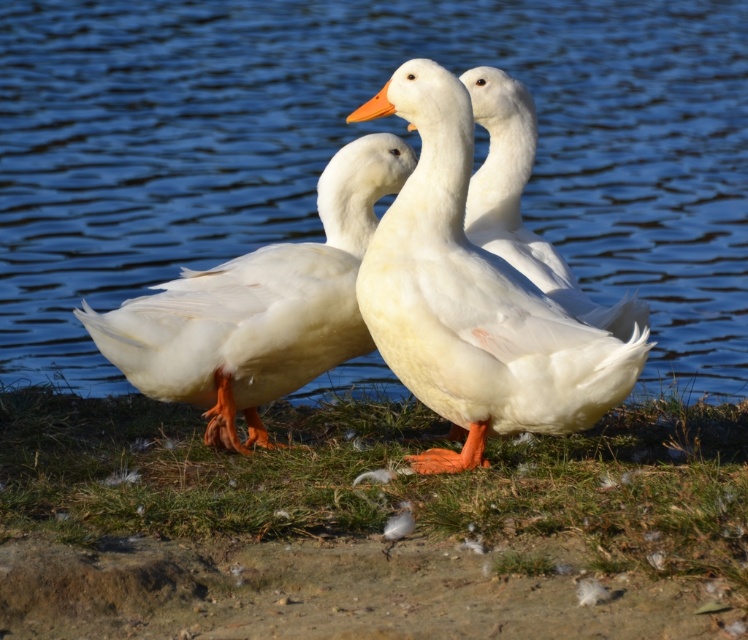
You are a photographer trying to capture a photo of the white feathered duck at center and the white feathered goose at center. Which one is positioned to the left side of the other?

The white feathered duck at center is positioned to the left of the white feathered goose at center.

You are a photographer trying to capture a photo of the two ducks in the scene. You notice that the white matte duck at center and the white feathered duck at center are very close. Which duck is positioned to the right of the other?

The white matte duck at center is positioned on the right side of the white feathered duck at center.

You are a photographer trying to capture a closeup of the ducks in the image. You notice two points marked in the scene. If you focus your camera on point 1 at point (613,20), will the point 2 at point (646,340) also be in focus? Explain your reasoning based on their positions.

Point 1 at point (613,20) is further to the camera than point 2 at point (646,340). Therefore, if you focus on point 1, point 2 will be slightly out of focus because it is closer to the camera than the focused point.